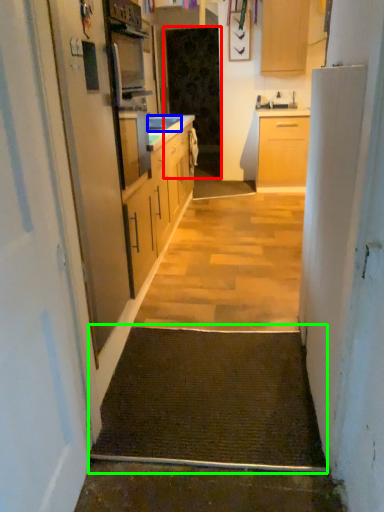
Question: Considering the real-world distances, which object is closest to screen door (highlighted by a red box)? sink (highlighted by a blue box) or doormat (highlighted by a green box).

Choices:
 (A) sink
 (B) doormat

Answer: (A)